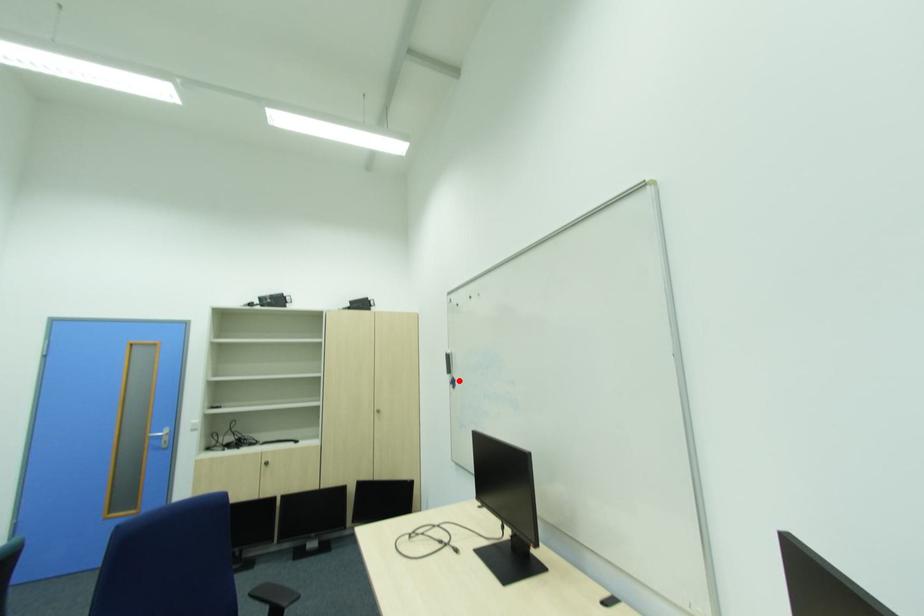
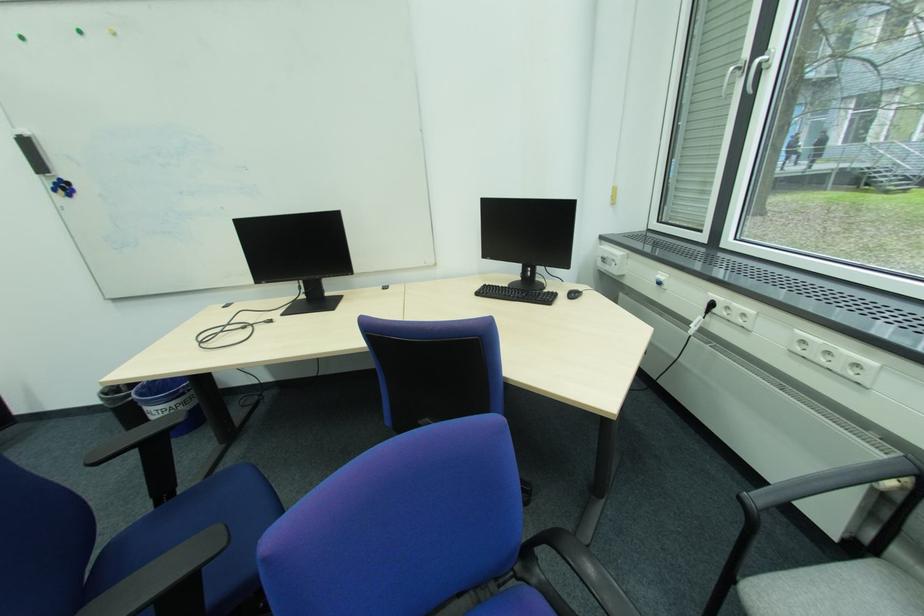
Question: I am providing you with two images of the same scene from different viewpoints. A red point is shown in image1. For the corresponding object point in image2, is it positioned nearer or farther from the camera?

Choices:
 (A) Nearer
 (B) Farther

Answer: (B)